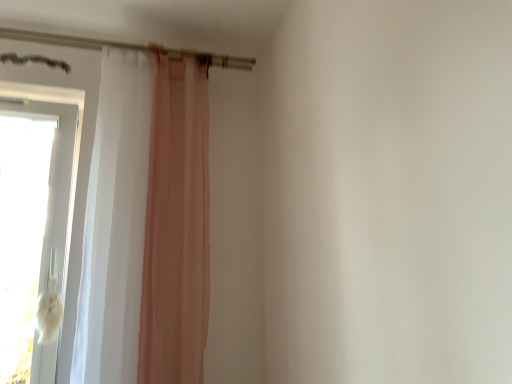
Question: Is sheer white curtain at left spatially inside white glossy door at left, or outside of it?

Choices:
 (A) inside
 (B) outside

Answer: (B)

Question: Is sheer white curtain at left in front of or behind white glossy door at left in the image?

Choices:
 (A) behind
 (B) front

Answer: (B)

Question: Looking at the image, does sheer white curtain at left seem bigger or smaller compared to white glossy door at left?

Choices:
 (A) small
 (B) big

Answer: (B)

Question: Looking at the image, does white glossy door at left seem bigger or smaller compared to sheer white curtain at left?

Choices:
 (A) big
 (B) small

Answer: (B)

Question: Does point (27, 52) appear closer or farther from the camera than point (112, 142)?

Choices:
 (A) farther
 (B) closer

Answer: (A)

Question: Do you think white glossy door at left is within sheer white curtain at left, or outside of it?

Choices:
 (A) inside
 (B) outside

Answer: (B)

Question: From a real-world perspective, is white glossy door at left physically located above or below sheer white curtain at left?

Choices:
 (A) below
 (B) above

Answer: (A)